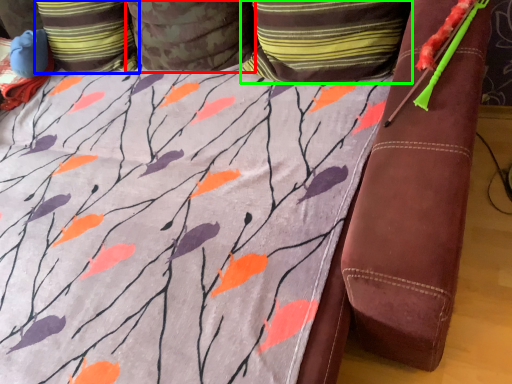
Question: Considering the real-world distances, which object is farthest from pillow (highlighted by a red box)? pillow (highlighted by a blue box) or pillow (highlighted by a green box)?

Choices:
 (A) pillow
 (B) pillow

Answer: (B)